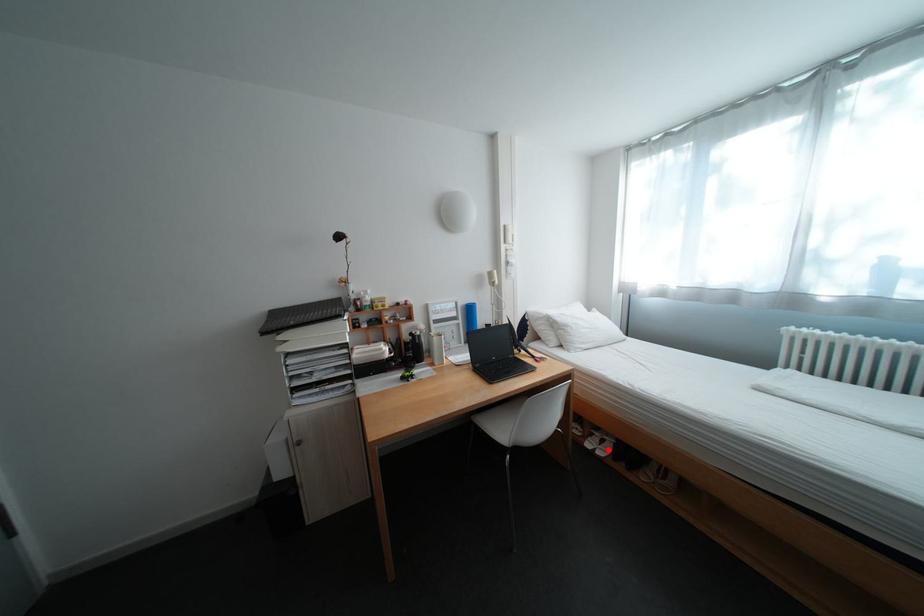
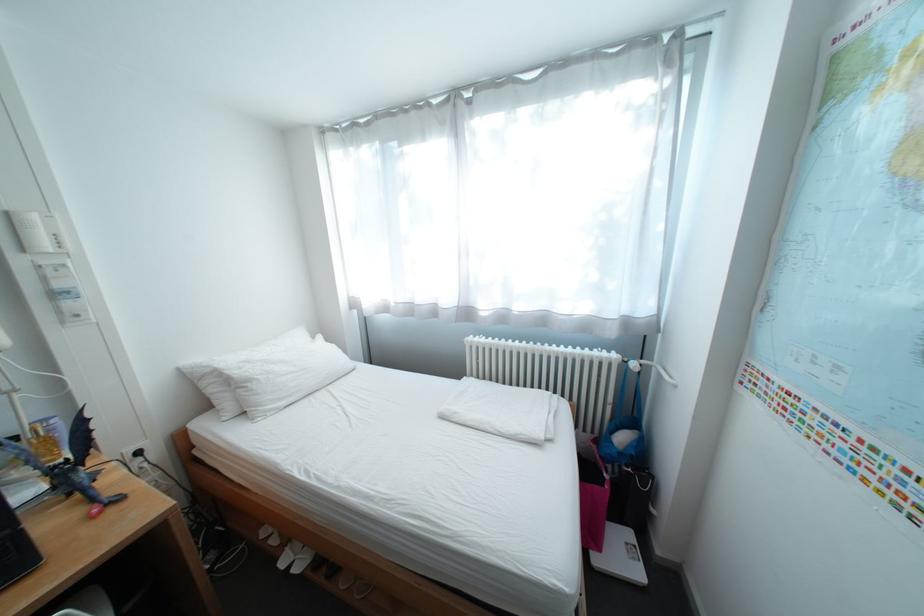
Locate, in the second image, the point that corresponds to the highlighted location in the first image.

(307, 562)